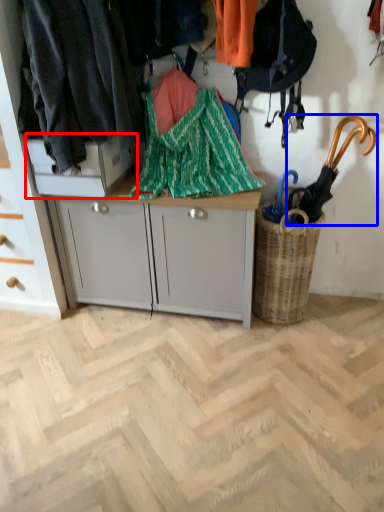
Question: Which object appears closest to the camera in this image, cabinetry (highlighted by a red box) or umbrella (highlighted by a blue box)?

Choices:
 (A) cabinetry
 (B) umbrella

Answer: (B)